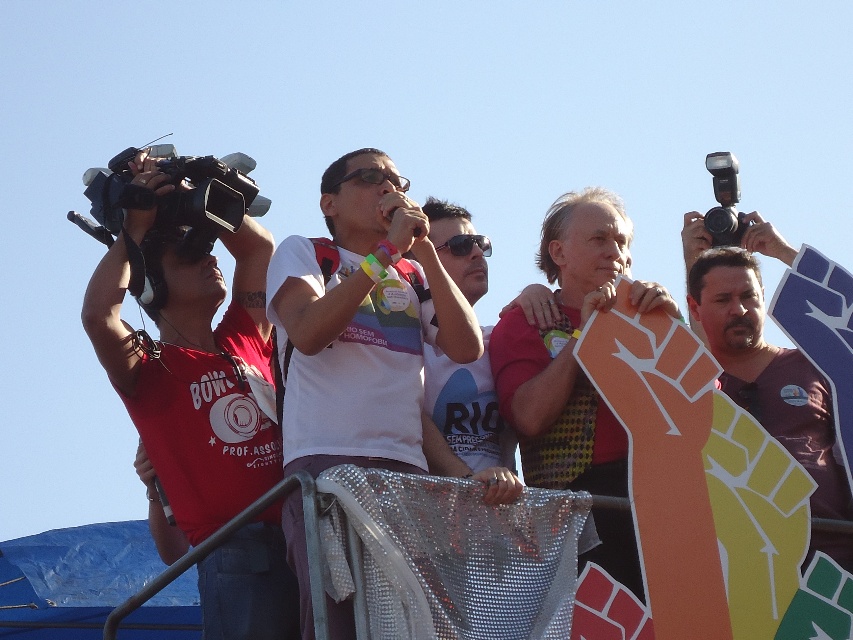
Based on the photo, you are a photographer at the event and want to capture both the central speaker and the sign with the raised fist symbol. The central speaker is at point [399,371] and the sign is at point [375,182]. Which of these two points is closer to you?

Point [399,371] is closer to the viewer than point [375,182].

You are a photographer at the event and need to capture both the clear plastic goggles at center and the black plastic sunglasses at center in a single frame. Which object should you position closer to the left side of your camera viewfinder to ensure both are visible?

Position the clear plastic goggles at center closer to the left side of the camera viewfinder since they are already to the left of the black plastic sunglasses at center, ensuring both are within the frame.

Consider the image. You are a photographer at the event and need to choose between the clear plastic goggles at center and the black plastic sunglasses at center for a closeup shot. Which object would you select if you want to capture the smaller item?

The clear plastic goggles at center is smaller than the black plastic sunglasses at center, so you should choose the clear plastic goggles at center for the closeup shot.